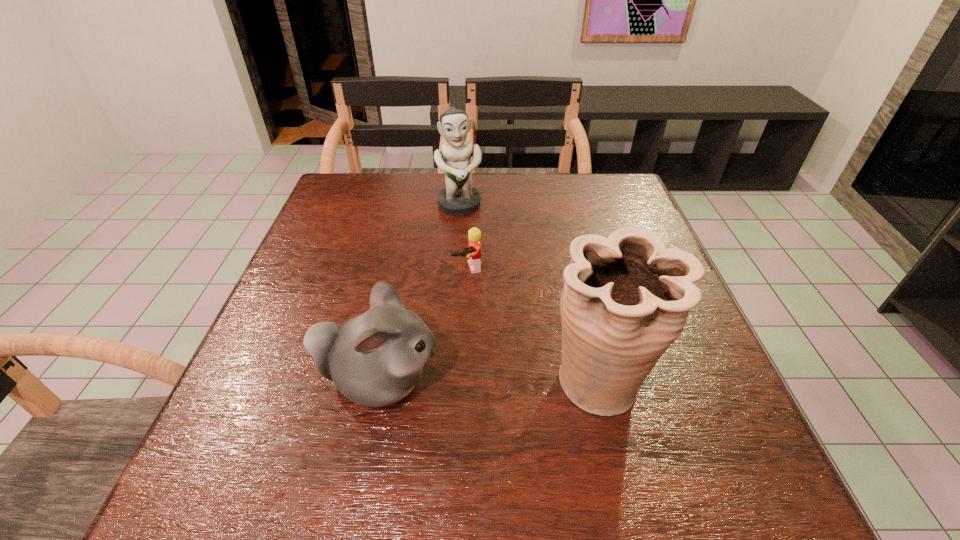
The image size is (960, 540). Identify the location of hamster. (375, 359).

You are a GUI agent. You are given a task and a screenshot of the screen. Output one action in this format:
    pyautogui.click(x=<x>, y=<y>)
    Task: Click on the rightmost object
    
    Given the screenshot: What is the action you would take?
    pyautogui.click(x=626, y=298)

Where is `figurine`? This screenshot has height=540, width=960. figurine is located at coordinates (459, 198).

Identify the location of the shortest object. (473, 251).

I want to click on the second farthest object, so click(473, 251).

What are the coordinates of `free space located 0.290m on the face of the second shortest object` in the screenshot? It's located at (596, 381).

Where is `vacant area situated on the left of the urn`? The height and width of the screenshot is (540, 960). vacant area situated on the left of the urn is located at coordinates (474, 380).

This screenshot has height=540, width=960. In order to click on vacant region located on the front-facing side of the figurine in this screenshot , I will do [467, 235].

Where is `vacant space located on the front-facing side of the figurine`? This screenshot has width=960, height=540. vacant space located on the front-facing side of the figurine is located at coordinates (469, 247).

You are a GUI agent. You are given a task and a screenshot of the screen. Output one action in this format:
    pyautogui.click(x=<x>, y=<y>)
    Task: Click on the vacant space located on the front-facing side of the figurine
    The image size is (960, 540).
    Given the screenshot: What is the action you would take?
    pyautogui.click(x=491, y=329)